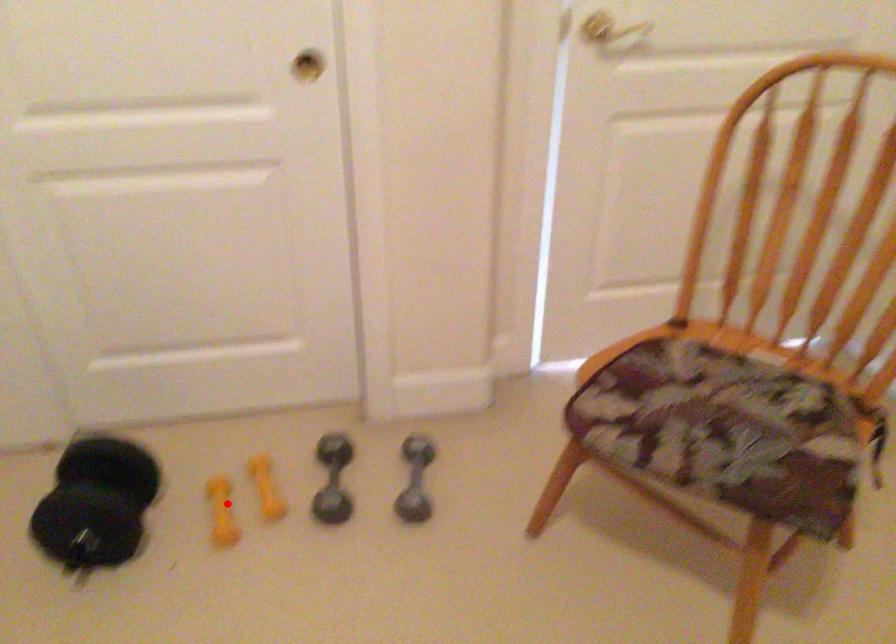
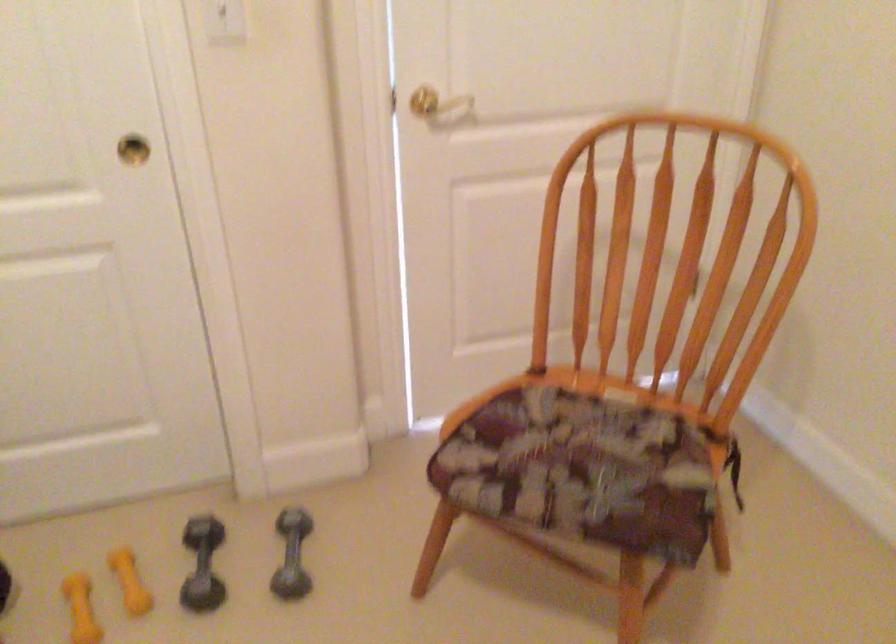
Question: I am providing you with two images of the same scene from different viewpoints. Given a red point in image1, look at the same physical point in image2. Is it:

Choices:
 (A) Closer to the viewpoint
 (B) Farther from the viewpoint

Answer: (A)